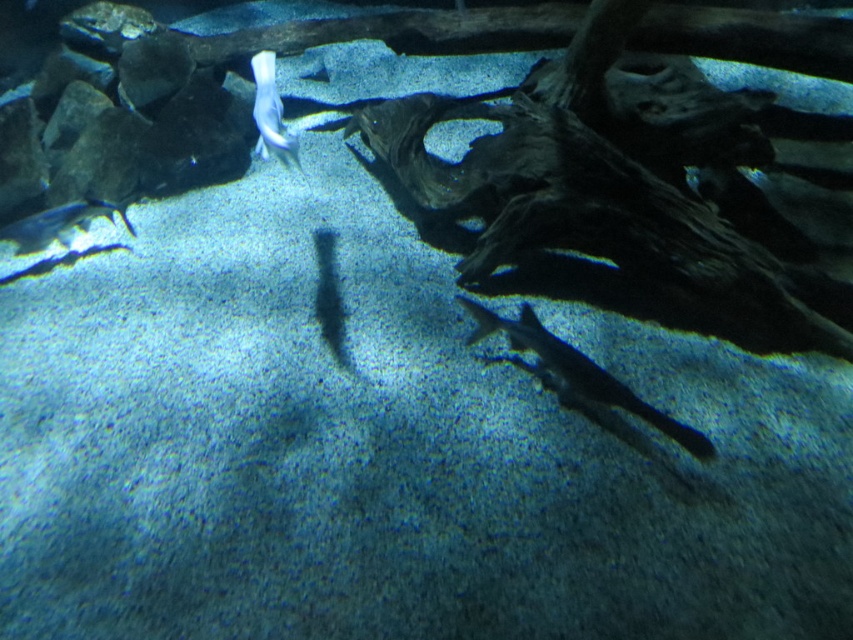
You are an underwater photographer aiming to capture both the translucent gray shark at lower right and the white glossy fish at upper center in a single frame. Based on their sizes, which fish should you focus on first to ensure they are both in the shot?

The translucent gray shark at lower right is much taller than the white glossy fish at upper center, so you should focus on the translucent gray shark at lower right first to ensure both are in the shot.

From the picture: You are a marine biologist observing an underwater scene. You notice a fish at point (579, 371). What is the identity and position of the fish at that coordinate?

The fish at point (579, 371) is a translucent gray shark located at the lower right of the image.